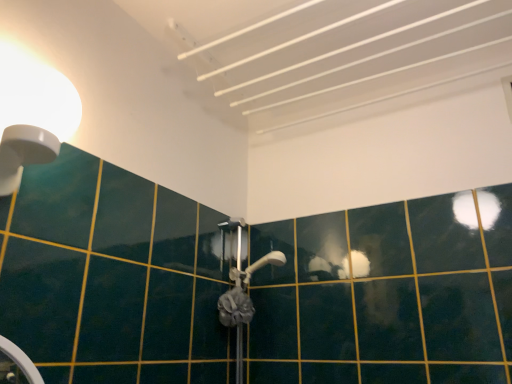
Measure the distance between white glossy light fixture at upper left and camera.

The distance of white glossy light fixture at upper left from camera is 30.45 inches.

Describe the element at coordinates (32, 115) in the screenshot. I see `white glossy light fixture at upper left` at that location.

Identify the location of white glossy light fixture at upper left. This screenshot has height=384, width=512. (32, 115).

What do you see at coordinates (243, 292) in the screenshot? The width and height of the screenshot is (512, 384). I see `gray fabric shower at center` at bounding box center [243, 292].

The width and height of the screenshot is (512, 384). I want to click on gray fabric shower at center, so click(x=243, y=292).

Identify the location of white glossy light fixture at upper left. (32, 115).

Between gray fabric shower at center and white glossy light fixture at upper left, which one appears on the left side from the viewer's perspective?

Positioned to the left is white glossy light fixture at upper left.

Considering the relative positions of gray fabric shower at center and white glossy light fixture at upper left in the image provided, is gray fabric shower at center behind white glossy light fixture at upper left?

Yes, the depth of gray fabric shower at center is greater than that of white glossy light fixture at upper left.

Which is nearer, (234, 313) or (3, 70)?

Point (234, 313).

From the image's perspective, which is above, gray fabric shower at center or white glossy light fixture at upper left?

white glossy light fixture at upper left.

From a real-world perspective, does gray fabric shower at center sit lower than white glossy light fixture at upper left?

Yes, from a real-world perspective, gray fabric shower at center is below white glossy light fixture at upper left.

Is gray fabric shower at center wider or thinner than white glossy light fixture at upper left?

Clearly, gray fabric shower at center has less width compared to white glossy light fixture at upper left.

Is gray fabric shower at center shorter than white glossy light fixture at upper left?

Correct, gray fabric shower at center is not as tall as white glossy light fixture at upper left.

Can you confirm if gray fabric shower at center is smaller than white glossy light fixture at upper left?

Indeed, gray fabric shower at center has a smaller size compared to white glossy light fixture at upper left.

Is gray fabric shower at center situated inside white glossy light fixture at upper left or outside?

gray fabric shower at center is outside white glossy light fixture at upper left.

Are gray fabric shower at center and white glossy light fixture at upper left far apart?

No, gray fabric shower at center is in close proximity to white glossy light fixture at upper left.

Is gray fabric shower at center oriented towards white glossy light fixture at upper left?

No.

What's the angular difference between gray fabric shower at center and white glossy light fixture at upper left's facing directions?

There is a 1.2-degree angle between the facing directions of gray fabric shower at center and white glossy light fixture at upper left.

How much distance is there between gray fabric shower at center and white glossy light fixture at upper left?

gray fabric shower at center is 33.00 inches from white glossy light fixture at upper left.

Where is `light fixture above the gray fabric shower at center (from a real-world perspective)`? Image resolution: width=512 pixels, height=384 pixels. light fixture above the gray fabric shower at center (from a real-world perspective) is located at coordinates (32, 115).

Which is more to the left, white glossy light fixture at upper left or gray fabric shower at center?

white glossy light fixture at upper left.

Which object is further away from the camera taking this photo, white glossy light fixture at upper left or gray fabric shower at center?

gray fabric shower at center is further away from the camera.

Does point (29, 70) come in front of point (230, 324)?

That is True.

From the image's perspective, which object appears higher, white glossy light fixture at upper left or gray fabric shower at center?

white glossy light fixture at upper left, from the image's perspective.

From a real-world perspective, who is located higher, white glossy light fixture at upper left or gray fabric shower at center?

white glossy light fixture at upper left, from a real-world perspective.

Is white glossy light fixture at upper left thinner than gray fabric shower at center?

In fact, white glossy light fixture at upper left might be wider than gray fabric shower at center.

Is white glossy light fixture at upper left taller than gray fabric shower at center?

Correct, white glossy light fixture at upper left is much taller as gray fabric shower at center.

Between white glossy light fixture at upper left and gray fabric shower at center, which one has smaller size?

gray fabric shower at center is smaller.

Is white glossy light fixture at upper left inside the boundaries of gray fabric shower at center, or outside?

white glossy light fixture at upper left lies outside gray fabric shower at center.

Is white glossy light fixture at upper left next to gray fabric shower at center and touching it?

No.

Is white glossy light fixture at upper left facing away from gray fabric shower at center?

white glossy light fixture at upper left does not have its back to gray fabric shower at center.

How distant is white glossy light fixture at upper left from gray fabric shower at center?

white glossy light fixture at upper left is 33.00 inches from gray fabric shower at center.

What are the coordinates of `light fixture above the gray fabric shower at center (from a real-world perspective)` in the screenshot? It's located at (32, 115).

Identify the location of light fixture that is on the left side of gray fabric shower at center. This screenshot has width=512, height=384. (32, 115).

The image size is (512, 384). In order to click on shower below the white glossy light fixture at upper left (from the image's perspective) in this screenshot , I will do `click(243, 292)`.